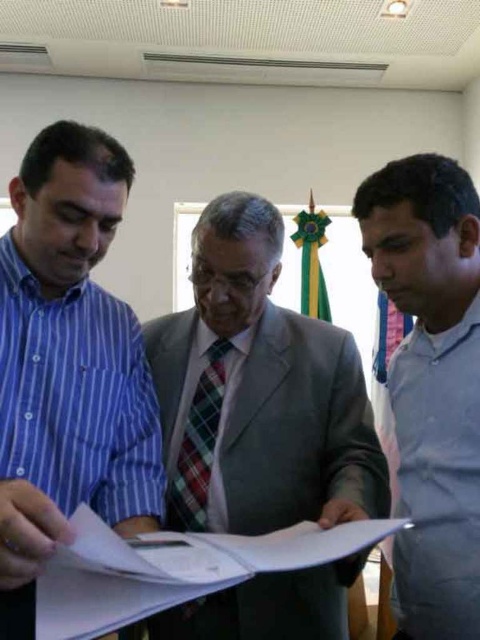
You are a photographer trying to capture the man in the blue striped shirt at left. The camera you are using has a focus point set at coordinate point [68,364]. Will this focus point be effective for capturing the man in the blue striped shirt at left?

Yes, the focus point at [68,364] corresponds to the blue striped shirt at left, so it will effectively capture him.

You are an interior designer assessing the spatial arrangement of clothing items in the scene. Considering the sizes of the gray smooth shirt at right and the plaid fabric tie at center, which one would require more storage space in a drawer?

The gray smooth shirt at right is bigger than the plaid fabric tie at center, so it would require more storage space in a drawer.